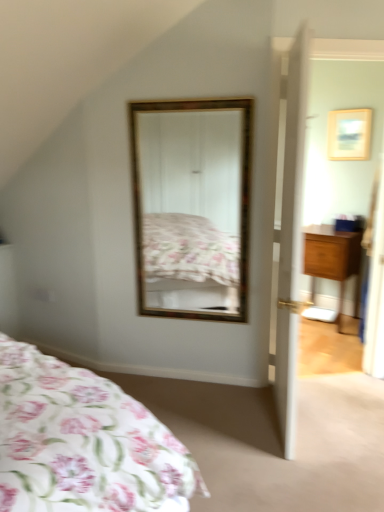
Image resolution: width=384 pixels, height=512 pixels. In order to click on free space in front of white wooden door at right in this screenshot , I will do `click(300, 471)`.